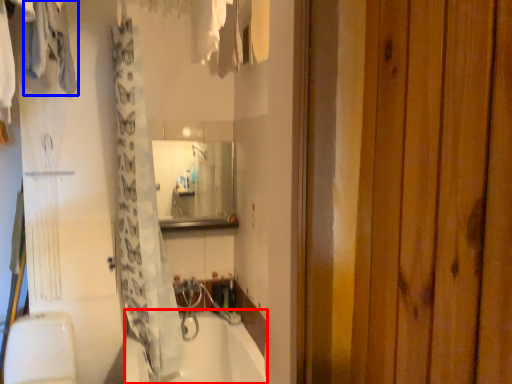
Question: Which of the following is the farthest to the observer, bathtub (highlighted by a red box) or clothing (highlighted by a blue box)?

Choices:
 (A) bathtub
 (B) clothing

Answer: (A)